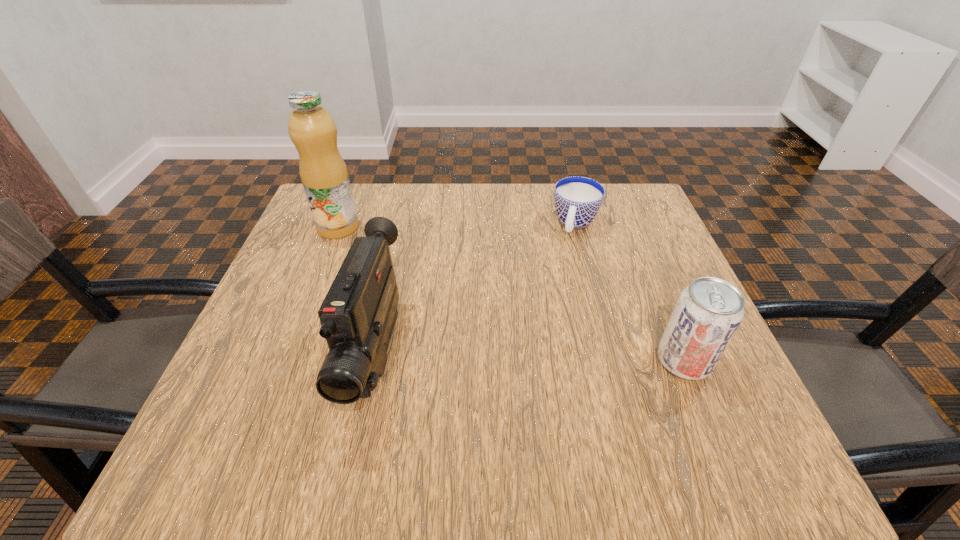
Locate an element on the screen. This screenshot has width=960, height=540. vacant spot on the desktop that is between the camcorder and the third tallest object and is positioned on the side of the cup with the handle is located at coordinates (527, 357).

Where is `free space on the desktop that is between the second tallest object and the third tallest object and is positioned on the front label of the leftmost object`? The width and height of the screenshot is (960, 540). free space on the desktop that is between the second tallest object and the third tallest object and is positioned on the front label of the leftmost object is located at coordinates (518, 357).